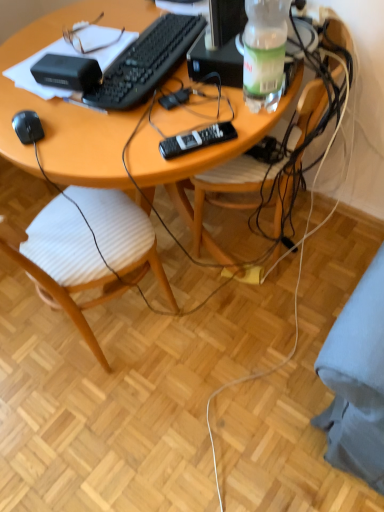
Locate an element on the screen. vacant space that is in between black plastic remote at center and clear plastic bottle at upper right is located at coordinates (226, 122).